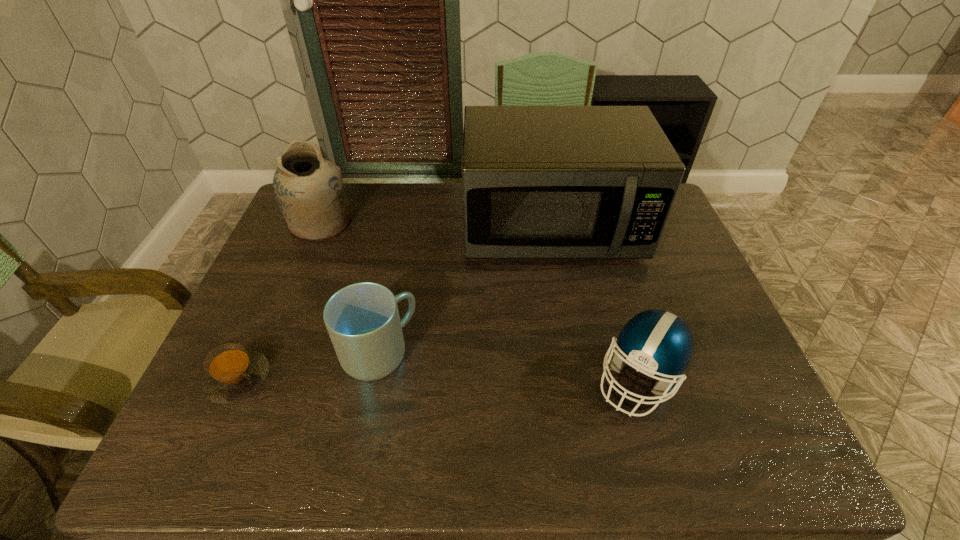
Find the location of a particular element. The width and height of the screenshot is (960, 540). vacant space at the left edge is located at coordinates (218, 423).

Locate an element on the screen. This screenshot has width=960, height=540. free location at the right edge of the desktop is located at coordinates (663, 284).

This screenshot has width=960, height=540. I want to click on vacant area at the near left corner of the desktop, so click(208, 455).

In the image, there is a desktop. Where is `vacant space at the near right corner`? The width and height of the screenshot is (960, 540). vacant space at the near right corner is located at coordinates (780, 451).

Find the location of a particular element. The width and height of the screenshot is (960, 540). blank region between the football helmet and the cappuccino is located at coordinates (439, 378).

The width and height of the screenshot is (960, 540). I want to click on vacant space that's between the tallest object and the pottery, so click(436, 225).

The image size is (960, 540). Identify the location of empty location between the mug and the football helmet. (509, 366).

Find the location of `vacant space that's between the football helmet and the tallest object`. vacant space that's between the football helmet and the tallest object is located at coordinates (595, 303).

What are the coordinates of `free point between the cappuccino and the football helmet` in the screenshot? It's located at (439, 378).

Find the location of `object identified as the closest to the third object from right to left`. object identified as the closest to the third object from right to left is located at coordinates (233, 373).